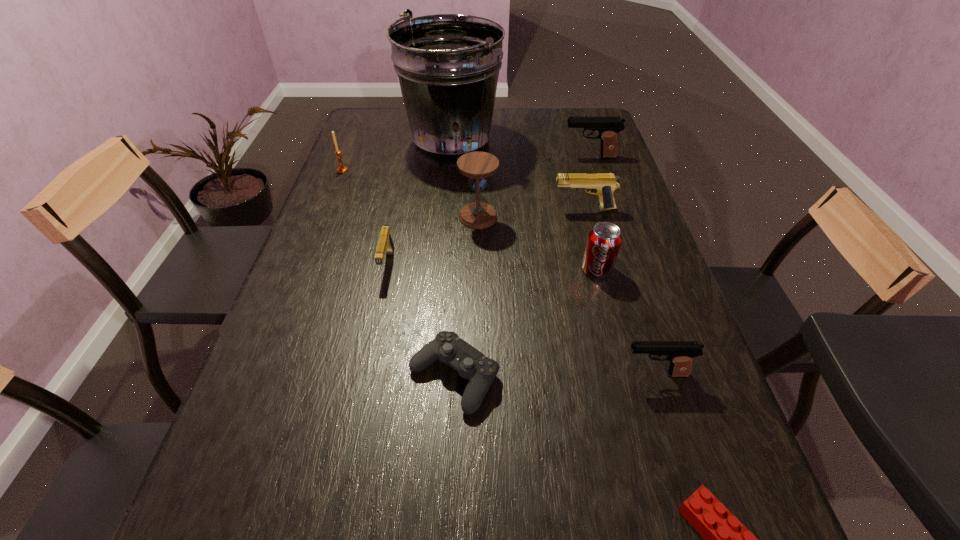
Locate an element on the screen. This screenshot has width=960, height=540. the tallest object is located at coordinates tap(447, 65).

Find the location of `hourglass`. hourglass is located at coordinates point(477,166).

Find the location of `the tallest pistol`. the tallest pistol is located at coordinates (608, 127).

At what (x,y) coordinates should I click in order to perform the action: click on the farthest pistol. Please return your answer as a coordinate pair (x, y). The width and height of the screenshot is (960, 540). Looking at the image, I should click on (608, 127).

Find the location of `candle_holder`. candle_holder is located at coordinates 342,169.

You are a GUI agent. You are given a task and a screenshot of the screen. Output one action in this format:
    pyautogui.click(x=<x>, y=<y>)
    Task: Click on the soda can
    
    Given the screenshot: What is the action you would take?
    pyautogui.click(x=604, y=240)

Locate an element on the screen. This screenshot has width=960, height=540. the right tan pistol is located at coordinates (602, 184).

The width and height of the screenshot is (960, 540). What are the coordinates of `the farther tan pistol` in the screenshot? It's located at (602, 184).

At what (x,y) coordinates should I click in order to perform the action: click on the nearest pistol. Please return your answer as a coordinate pair (x, y). Looking at the image, I should click on pyautogui.click(x=680, y=354).

This screenshot has width=960, height=540. Find the location of `the nearer black pistol`. the nearer black pistol is located at coordinates (680, 354).